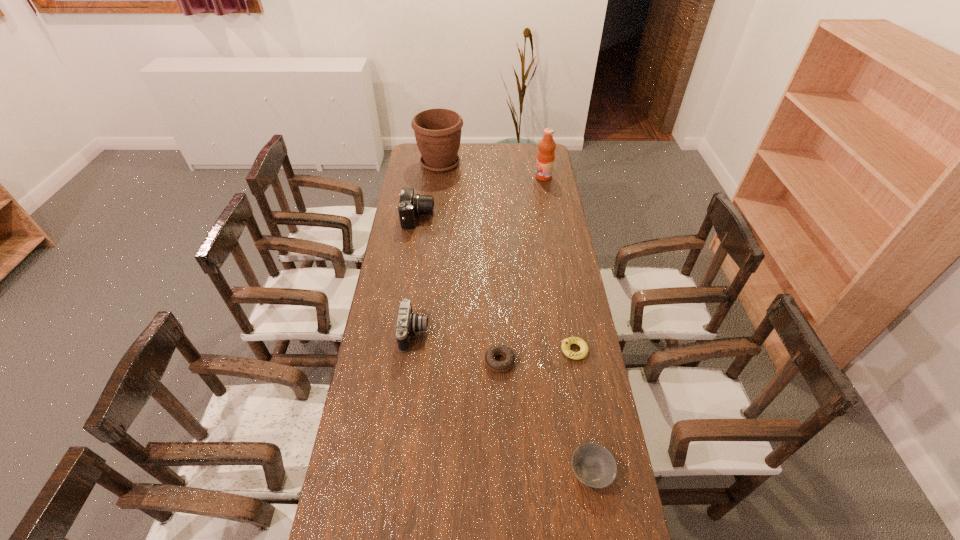
This screenshot has width=960, height=540. Find the location of `free space located 0.340m on the front label of the fruit juice`. free space located 0.340m on the front label of the fruit juice is located at coordinates (469, 177).

Image resolution: width=960 pixels, height=540 pixels. I want to click on blank space located on the front label of the fruit juice, so click(x=489, y=177).

Locate an element on the screen. The width and height of the screenshot is (960, 540). vacant space located on the back of the flowerpot is located at coordinates (443, 144).

The image size is (960, 540). I want to click on free region located 0.120m on the lens of the farther camera, so click(460, 218).

Identify the location of vacant region located 0.350m on the front-facing side of the nearer camera. (525, 333).

You are a GUI agent. You are given a task and a screenshot of the screen. Output one action in this format:
    pyautogui.click(x=<x>, y=<y>)
    Task: Click on the free space located on the face of the duckling
    The width and height of the screenshot is (960, 540).
    Given the screenshot: What is the action you would take?
    pyautogui.click(x=524, y=350)

Image resolution: width=960 pixels, height=540 pixels. I want to click on free spot located 0.160m on the face of the duckling, so click(513, 350).

Find the location of `vacant space located on the face of the duckling`. vacant space located on the face of the duckling is located at coordinates (481, 350).

Find the location of a particular element. The image size is (960, 540). vacant space located 0.110m on the back of the bowl is located at coordinates (582, 415).

The width and height of the screenshot is (960, 540). I want to click on vacant region located 0.330m on the front of the doughnut, so click(x=504, y=477).